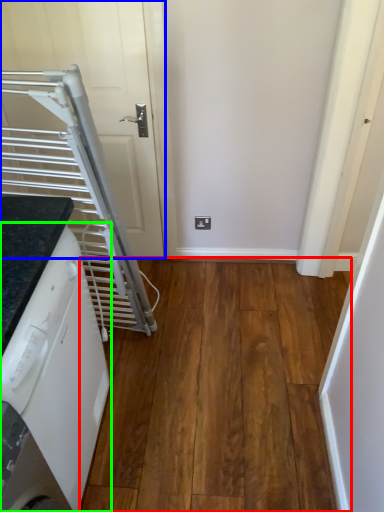
Question: Considering the real-world distances, which object is closest to hardwood (highlighted by a red box)? door (highlighted by a blue box) or home appliance (highlighted by a green box).

Choices:
 (A) door
 (B) home appliance

Answer: (B)